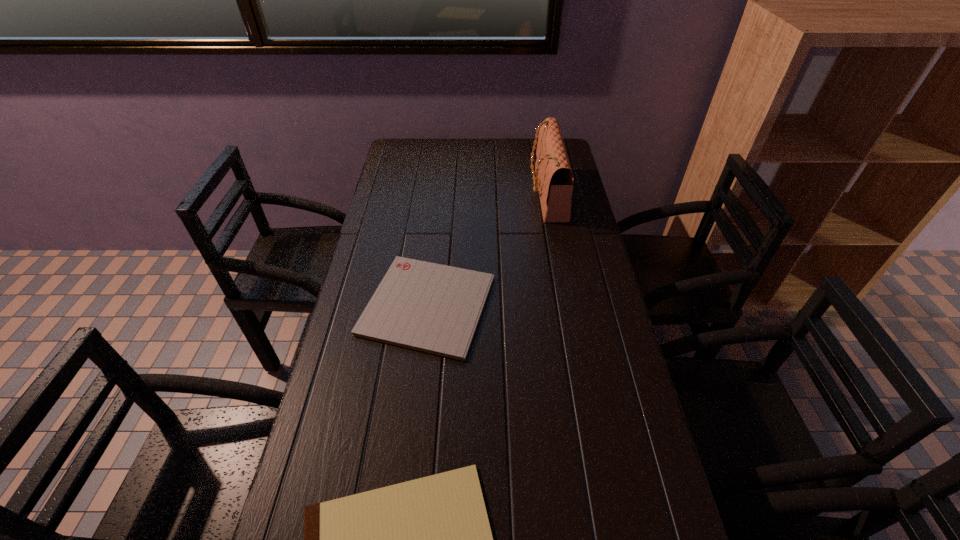
Locate an element on the screen. This screenshot has width=960, height=540. free space that satisfies the following two spatial constraints: 1. on the front-facing side of the rightmost object; 2. on the front side of the farther clipboard is located at coordinates (567, 305).

The height and width of the screenshot is (540, 960). In order to click on vacant space that satisfies the following two spatial constraints: 1. on the front-facing side of the farthest object; 2. on the front side of the farther clipboard in this screenshot , I will do `click(567, 305)`.